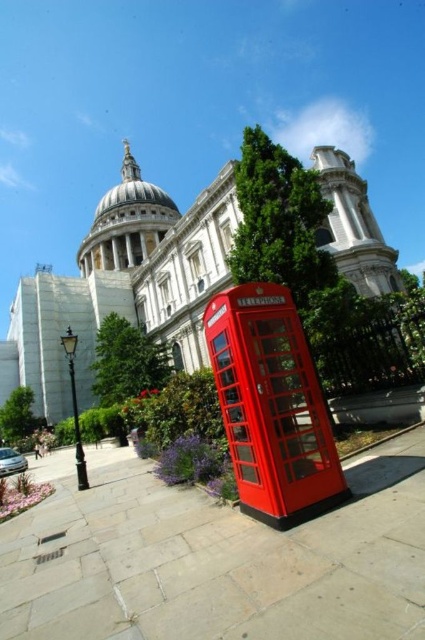
You are standing in front of St. Paul Cathedral and want to take a photo of the glossy red telephone box at lower center. However, there is a slate gray paving stone at lower center in the way. Can you still take a clear photo of the telephone box without moving the paving stone?

The slate gray paving stone at lower center is closer to the viewer than the glossy red telephone box at lower center, so the paving stone will block the view of the telephone box. You cannot take a clear photo without moving the paving stone.

You are standing at the base of St. Paul Cathedral and want to take a photo of both the red telephone box and the cathedral. The telephone box is located at point (394, 440) and the cathedral is at point (204, 321). Since you want to ensure both are in focus, which object should you position closer to your camera to achieve this?

Point (394, 440) is closer to the viewer than point (204, 321), so you should position yourself closer to the telephone box at point (394, 440) to ensure both it and the cathedral at point (204, 321) are in focus.